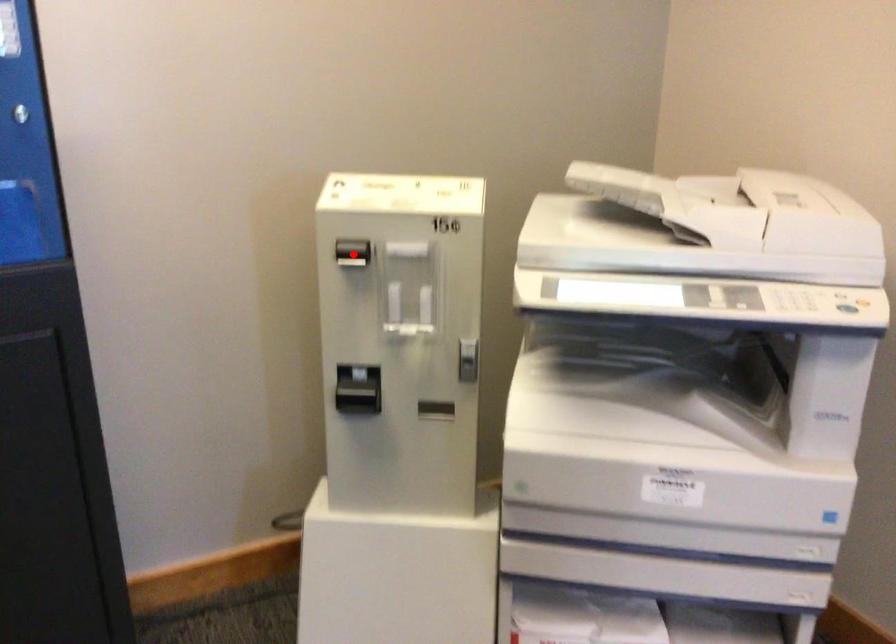
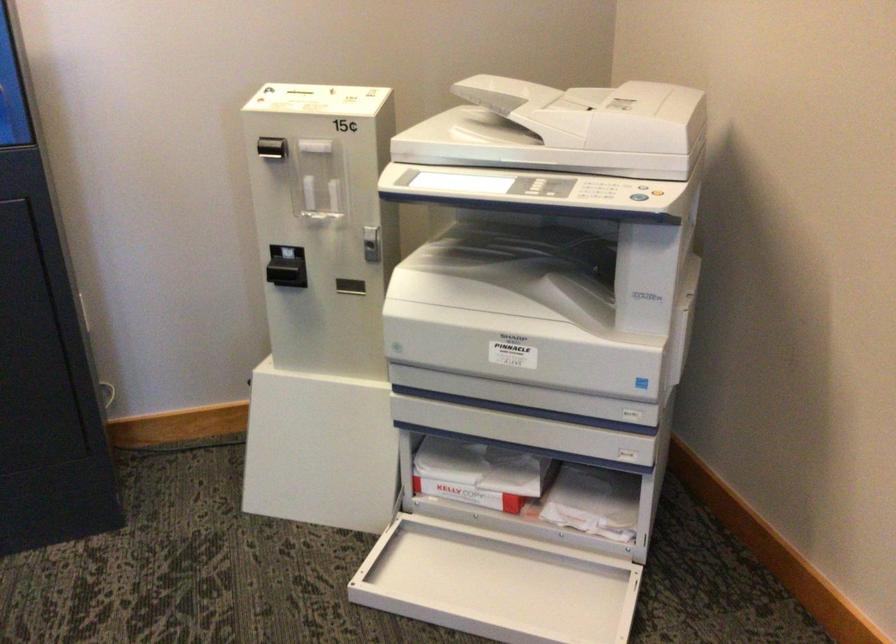
Question: I am providing you with two images of the same scene from different viewpoints. A red point is shown in image1. For the corresponding object point in image2, is it positioned nearer or farther from the camera?

Choices:
 (A) Nearer
 (B) Farther

Answer: (B)